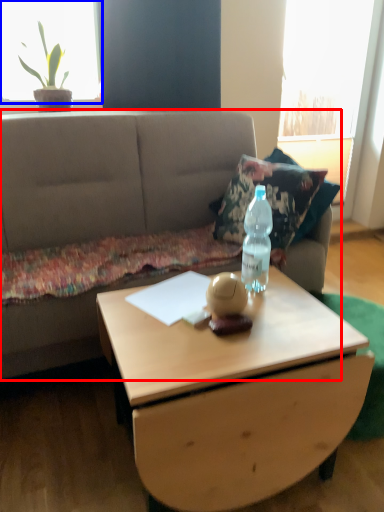
Question: Which object is further to the camera taking this photo, studio couch (highlighted by a red box) or window screen (highlighted by a blue box)?

Choices:
 (A) studio couch
 (B) window screen

Answer: (B)